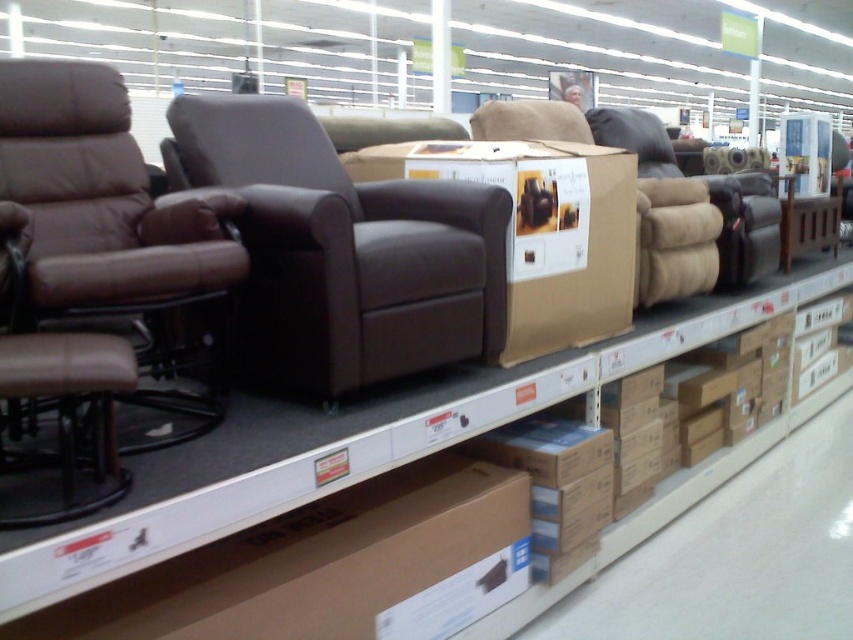
Is brown leather armchair at center bigger than brown leather swivel chair at left?

Yes, brown leather armchair at center is bigger than brown leather swivel chair at left.

Is point (263, 276) closer to camera compared to point (74, 68)?

Yes.

The height and width of the screenshot is (640, 853). Describe the element at coordinates (341, 250) in the screenshot. I see `brown leather armchair at center` at that location.

The width and height of the screenshot is (853, 640). I want to click on brown leather armchair at center, so click(x=341, y=250).